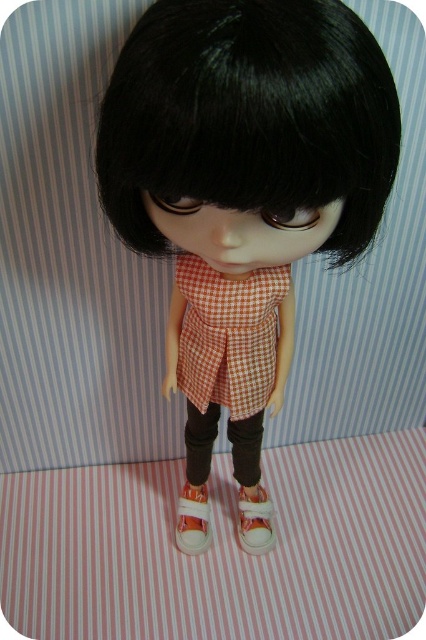
Between black matte wig at center and checkered fabric dress at center, which one appears on the left side from the viewer's perspective?

From the viewer's perspective, checkered fabric dress at center appears more on the left side.

Who is more distant from viewer, (x=204, y=148) or (x=219, y=368)?

Point (x=219, y=368)

This screenshot has width=426, height=640. In order to click on black matte wig at center in this screenshot , I will do `click(250, 115)`.

From the picture: Does white canvas shoe at lower center have a smaller size compared to white canvas shoe at center?

No.

Can you confirm if white canvas shoe at lower center is positioned to the left of white canvas shoe at center?

Indeed, white canvas shoe at lower center is positioned on the left side of white canvas shoe at center.

Is point (186, 502) more distant than point (270, 538)?

Yes, point (186, 502) is behind point (270, 538).

You are a GUI agent. You are given a task and a screenshot of the screen. Output one action in this format:
    pyautogui.click(x=<x>, y=<y>)
    Task: Click on the white canvas shoe at lower center
    Image resolution: width=426 pixels, height=640 pixels.
    Given the screenshot: What is the action you would take?
    pyautogui.click(x=192, y=520)

Is checkered fabric dress at center positioned in front of white canvas shoe at lower center?

Yes, it is.

Who is more distant from viewer, (x=207, y=284) or (x=193, y=547)?

Point (x=193, y=547)

Identify the location of checkered fabric dress at center. (229, 336).